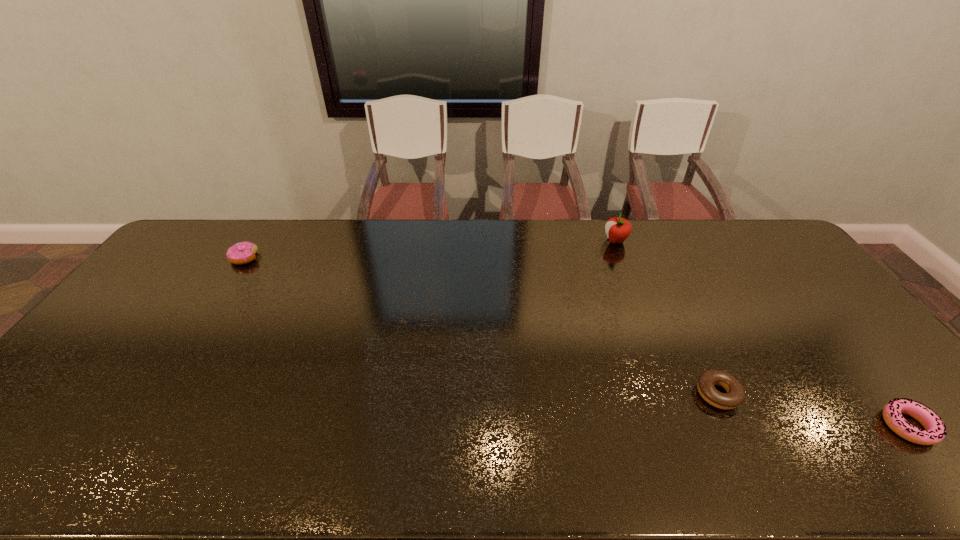
Find the location of a particular element. free space at the far right corner of the desktop is located at coordinates (773, 248).

At what (x,y) coordinates should I click in order to perform the action: click on blank region between the third nearest object and the second doughnut from right to left. Please return your answer as a coordinate pair (x, y). The image size is (960, 540). Looking at the image, I should click on (481, 326).

Image resolution: width=960 pixels, height=540 pixels. What are the coordinates of `free spot between the rightmost object and the tallest object` in the screenshot? It's located at (761, 333).

Locate an element on the screen. vacant area between the leftmost doughnut and the second doughnut from right to left is located at coordinates (481, 326).

Where is `free point between the third object from right to left and the leftmost object`? free point between the third object from right to left and the leftmost object is located at coordinates (430, 249).

I want to click on unoccupied area between the third object from left to right and the rightmost doughnut, so click(813, 410).

Identify the location of free space between the second object from right to left and the third object from right to left. The height and width of the screenshot is (540, 960). (667, 318).

The image size is (960, 540). I want to click on free spot between the second object from left to right and the second doughnut from left to right, so [x=667, y=318].

The image size is (960, 540). In order to click on free space between the leftmost doughnut and the rightmost doughnut in this screenshot , I will do `click(576, 342)`.

You are a GUI agent. You are given a task and a screenshot of the screen. Output one action in this format:
    pyautogui.click(x=<x>, y=<y>)
    Task: Click on the unoccupied position between the farthest doughnut and the rightmost doughnut
    
    Given the screenshot: What is the action you would take?
    pyautogui.click(x=576, y=342)